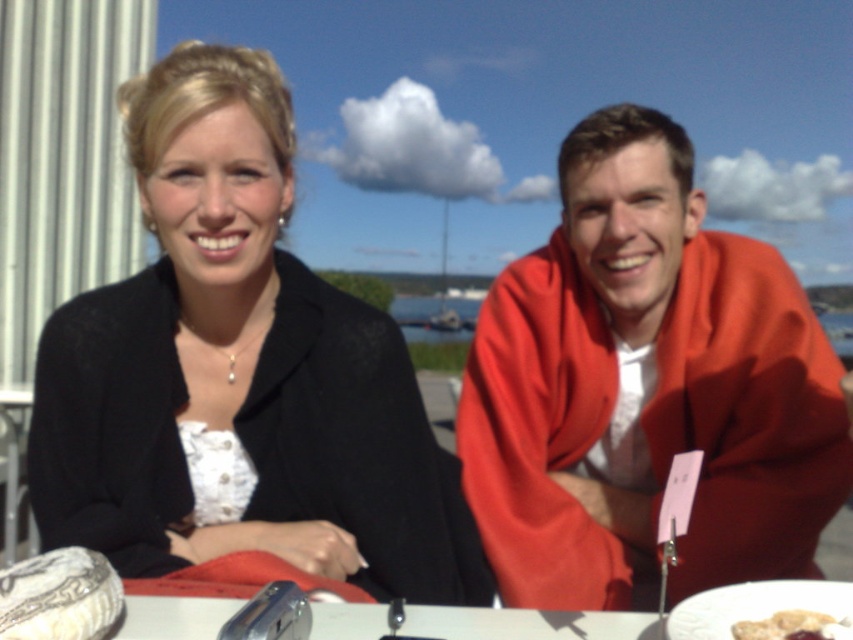
Is black matte blazer at center positioned behind matte red jacket at center?

No, it is in front of matte red jacket at center.

Is point (312, 540) positioned in front of point (567, 236)?

Yes, point (312, 540) is closer to viewer.

Image resolution: width=853 pixels, height=640 pixels. I want to click on black matte blazer at center, so click(x=238, y=372).

Is point (769, 595) farther from camera compared to point (738, 637)?

Yes, point (769, 595) is behind point (738, 637).

Can you confirm if white ceramic plate at lower right is thinner than smooth white bread at lower right?

No.

Where is `white ceramic plate at lower right`? white ceramic plate at lower right is located at coordinates (753, 605).

Locate an element on the screen. The width and height of the screenshot is (853, 640). white ceramic plate at lower right is located at coordinates (753, 605).

Is the position of black matte blazer at center less distant than that of smooth white bread at lower right?

No, black matte blazer at center is behind smooth white bread at lower right.

Who is more distant from viewer, [224,518] or [804,614]?

The point [224,518] is more distant.

Which is behind, point (165, 557) or point (735, 625)?

Point (165, 557)

Find the location of a particular element. black matte blazer at center is located at coordinates (238, 372).